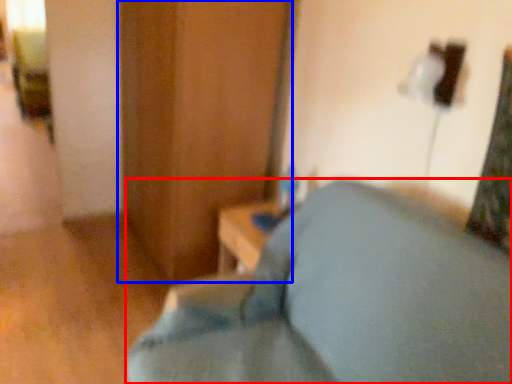
Question: Which object is closer to the camera taking this photo, furniture (highlighted by a red box) or dresser (highlighted by a blue box)?

Choices:
 (A) furniture
 (B) dresser

Answer: (A)